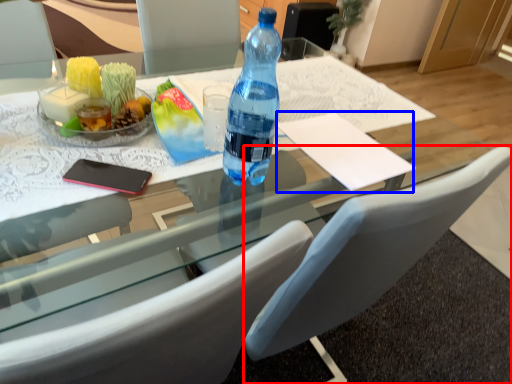
Question: Which of the following is the closest to the observer, chair (highlighted by a red box) or notepad (highlighted by a blue box)?

Choices:
 (A) chair
 (B) notepad

Answer: (A)